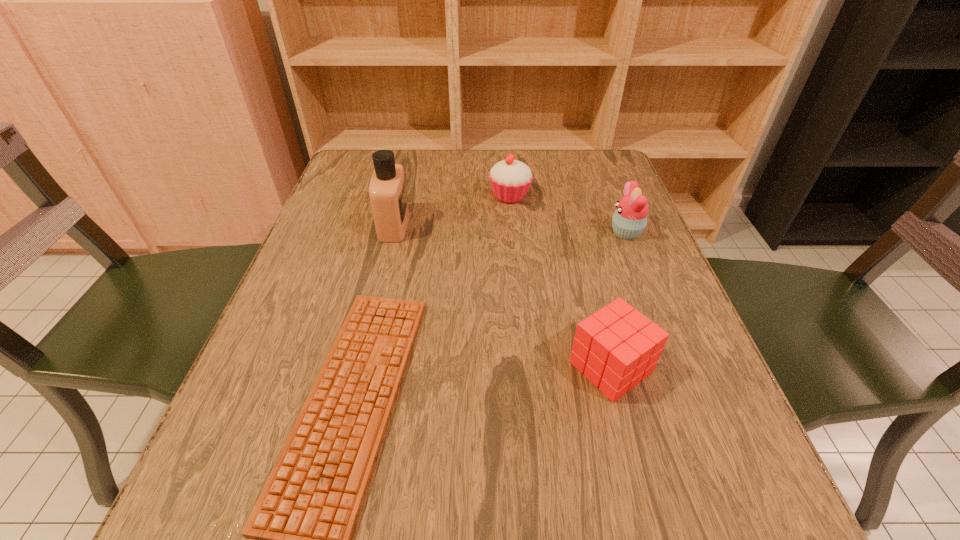
Find the location of a particular element. vacant region at the right edge of the desktop is located at coordinates (600, 269).

This screenshot has height=540, width=960. In order to click on vacant position at the far left corner of the desktop in this screenshot , I will do `click(362, 193)`.

Locate an element on the screen. free space at the far right corner of the desktop is located at coordinates (577, 189).

Identify the location of free space that is in between the third object from left to right and the rightmost object. This screenshot has width=960, height=540. (568, 214).

Where is `free spot between the second shortest object and the farthest object`? The height and width of the screenshot is (540, 960). free spot between the second shortest object and the farthest object is located at coordinates (561, 281).

This screenshot has width=960, height=540. Identify the location of free space between the perfume and the fourth object from left to right. (502, 296).

Find the location of a particular element. free space between the rightmost object and the tallest object is located at coordinates (510, 229).

Identify the location of free space between the tallest object and the right cupcake. The width and height of the screenshot is (960, 540). (510, 229).

This screenshot has height=540, width=960. What are the coordinates of `free area in between the tallest object and the cube` in the screenshot? It's located at (502, 296).

You are a GUI agent. You are given a task and a screenshot of the screen. Output one action in this format:
    pyautogui.click(x=<x>, y=<y>)
    Task: Click on the empty location between the perfume and the nearer cupcake
    
    Given the screenshot: What is the action you would take?
    pyautogui.click(x=510, y=229)